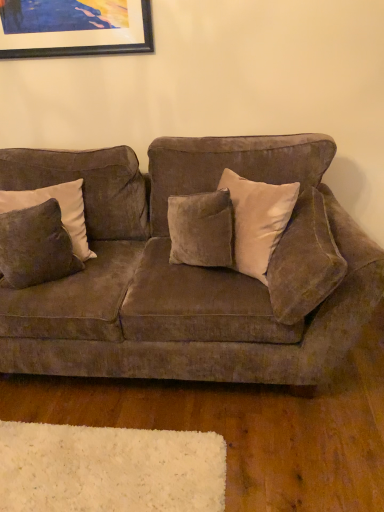
Question: Would you say velvet brown couch at center is outside velvet brown pillow at left, which ranks as the first pillow in left-to-right order?

Choices:
 (A) yes
 (B) no

Answer: (A)

Question: Considering the relative sizes of velvet brown couch at center and velvet brown pillow at left, placed as the 2th pillow when sorted from right to left, in the image provided, is velvet brown couch at center wider than velvet brown pillow at left, placed as the 2th pillow when sorted from right to left,?

Choices:
 (A) no
 (B) yes

Answer: (B)

Question: Can you confirm if velvet brown couch at center is smaller than velvet brown pillow at left, which ranks as the first pillow in left-to-right order?

Choices:
 (A) no
 (B) yes

Answer: (A)

Question: Considering the relative sizes of velvet brown couch at center and velvet brown pillow at left, which ranks as the first pillow in left-to-right order, in the image provided, is velvet brown couch at center shorter than velvet brown pillow at left, which ranks as the first pillow in left-to-right order,?

Choices:
 (A) yes
 (B) no

Answer: (B)

Question: From the image's perspective, is velvet brown couch at center beneath velvet brown pillow at left, placed as the 2th pillow when sorted from right to left?

Choices:
 (A) yes
 (B) no

Answer: (A)

Question: Considering the relative sizes of velvet brown couch at center and velvet brown pillow at left, placed as the 2th pillow when sorted from right to left, in the image provided, is velvet brown couch at center bigger than velvet brown pillow at left, placed as the 2th pillow when sorted from right to left,?

Choices:
 (A) no
 (B) yes

Answer: (B)

Question: Can you confirm if velvet brown couch at center is bigger than wooden picture frame at upper left?

Choices:
 (A) no
 (B) yes

Answer: (B)

Question: Does velvet brown couch at center come in front of wooden picture frame at upper left?

Choices:
 (A) no
 (B) yes

Answer: (B)

Question: Is the surface of velvet brown couch at center in direct contact with wooden picture frame at upper left?

Choices:
 (A) no
 (B) yes

Answer: (A)

Question: Does velvet brown couch at center lie behind wooden picture frame at upper left?

Choices:
 (A) yes
 (B) no

Answer: (B)

Question: Is velvet brown couch at center outside of wooden picture frame at upper left?

Choices:
 (A) yes
 (B) no

Answer: (A)

Question: Would you say velvet brown couch at center is a long distance from wooden picture frame at upper left?

Choices:
 (A) no
 (B) yes

Answer: (A)

Question: Is the depth of velvet brown couch at center greater than that of suede pillow at right, positioned as the second pillow in left-to-right order?

Choices:
 (A) yes
 (B) no

Answer: (B)